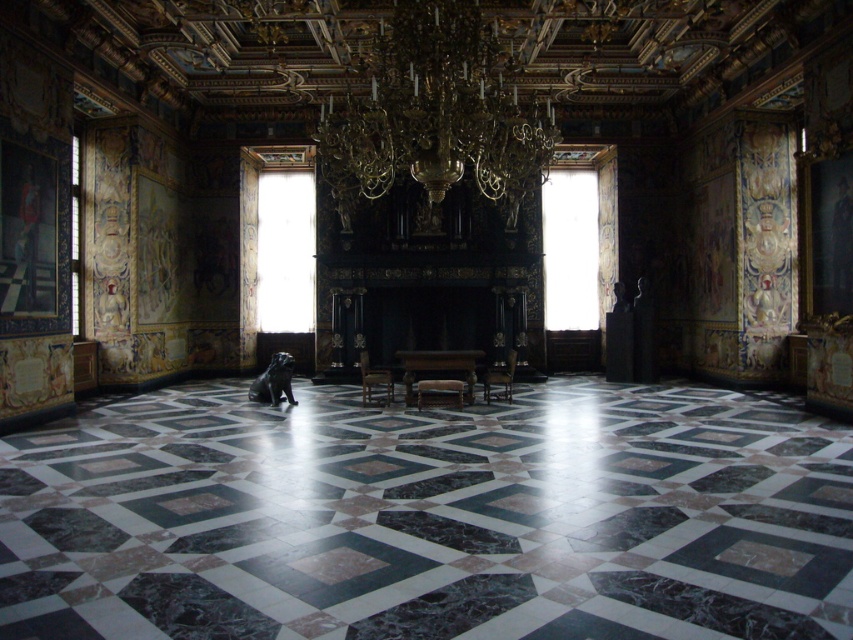
You are an interior designer planning to install a new light fixture above the wooden polished chair at center. However, there is already a wooden chair at center in the way. Which chair is positioned higher, requiring you to adjust the installation plan?

The wooden chair at center is positioned higher than the wooden polished chair at center, so you need to adjust the installation plan to avoid the wooden chair at center.